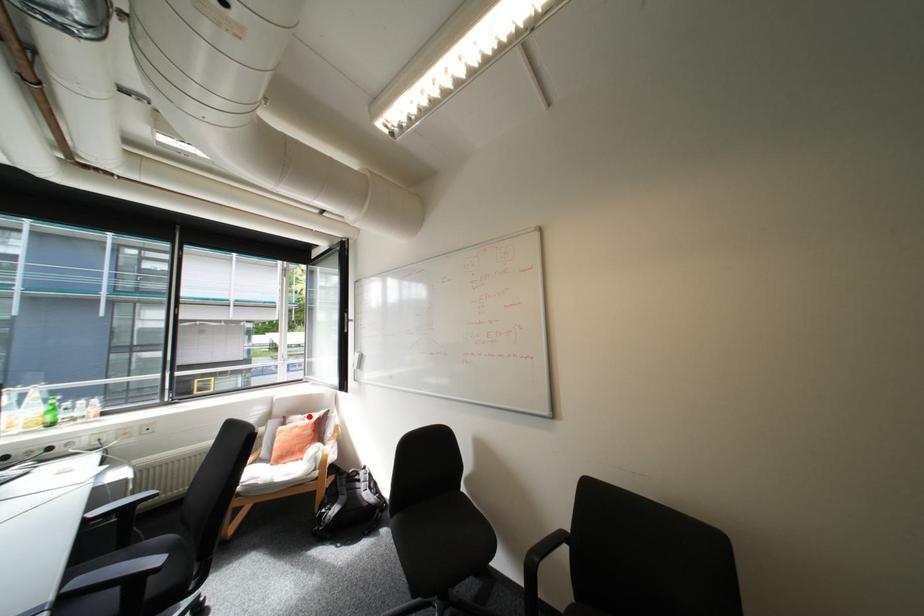
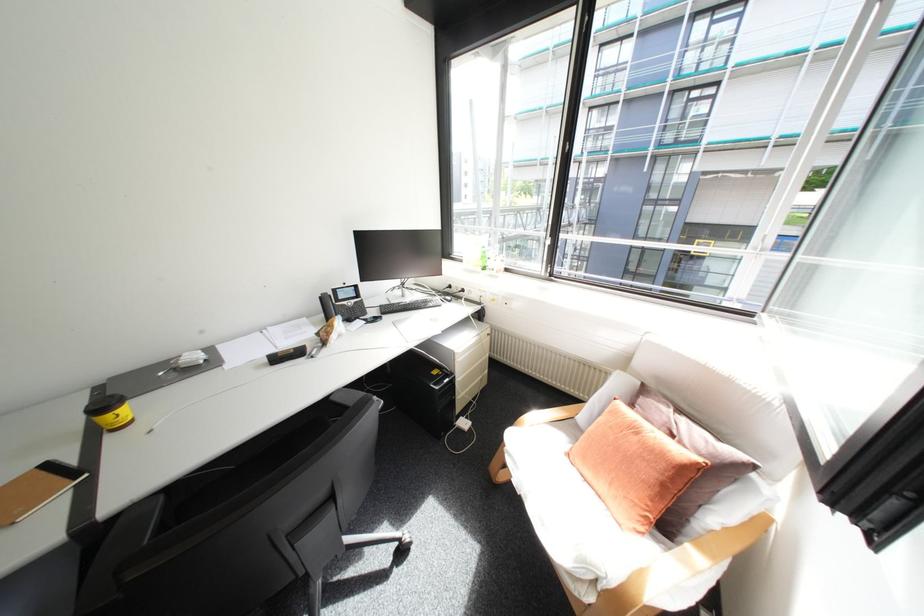
In the second image, find the point that corresponds to the highlighted location in the first image.

(677, 410)